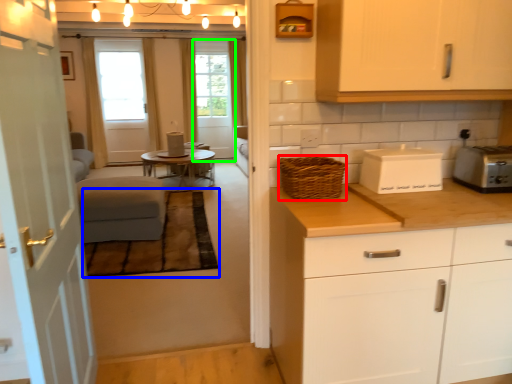
Question: Considering the real-world distances, which object is closest to basket (highlighted by a red box)? plain (highlighted by a blue box) or screen door (highlighted by a green box).

Choices:
 (A) plain
 (B) screen door

Answer: (A)